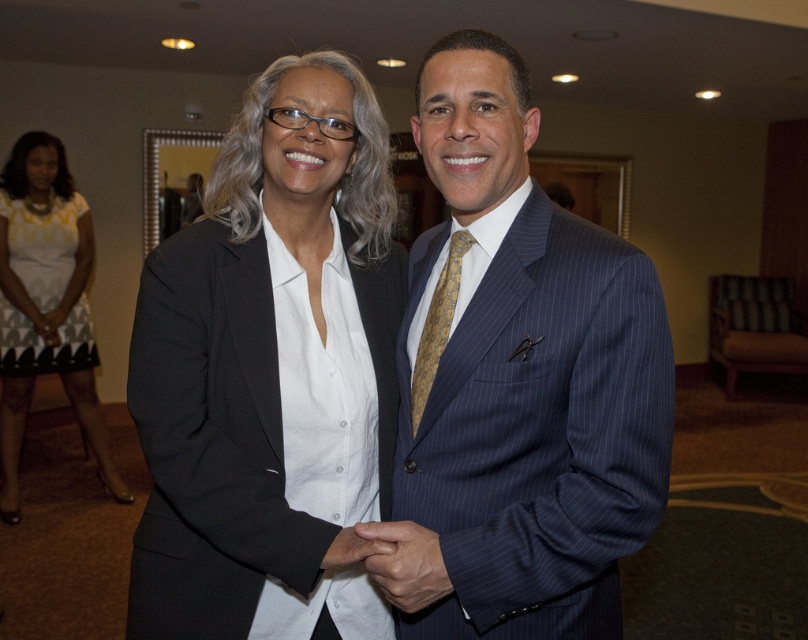
Question: Can you confirm if blue pinstripe suit at center is positioned below yellow silk tie at center?

Choices:
 (A) yes
 (B) no

Answer: (A)

Question: Which point appears farthest from the camera in this image?

Choices:
 (A) (181, 256)
 (B) (57, 300)
 (C) (444, 304)

Answer: (B)

Question: Among these points, which one is nearest to the camera?

Choices:
 (A) (9, 417)
 (B) (583, 378)
 (C) (78, 330)

Answer: (B)

Question: Can you confirm if white printed fabric dress at lower left is positioned above yellow silk tie at center?

Choices:
 (A) yes
 (B) no

Answer: (A)

Question: Among these objects, which one is nearest to the camera?

Choices:
 (A) yellow silk tie at center
 (B) blue pinstripe suit at center
 (C) matte black blazer at center

Answer: (B)

Question: Is matte black blazer at center below yellow silk tie at center?

Choices:
 (A) no
 (B) yes

Answer: (B)